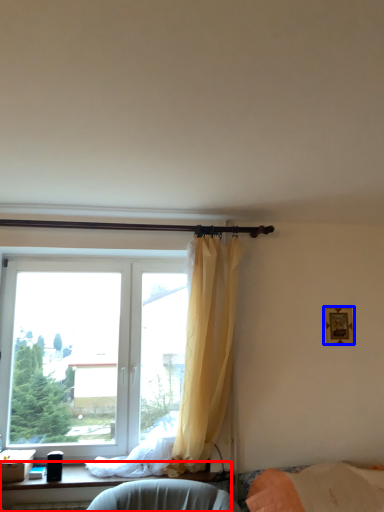
Question: Which point is closer to the camera, furniture (highlighted by a red box) or picture frame (highlighted by a blue box)?

Choices:
 (A) furniture
 (B) picture frame

Answer: (A)